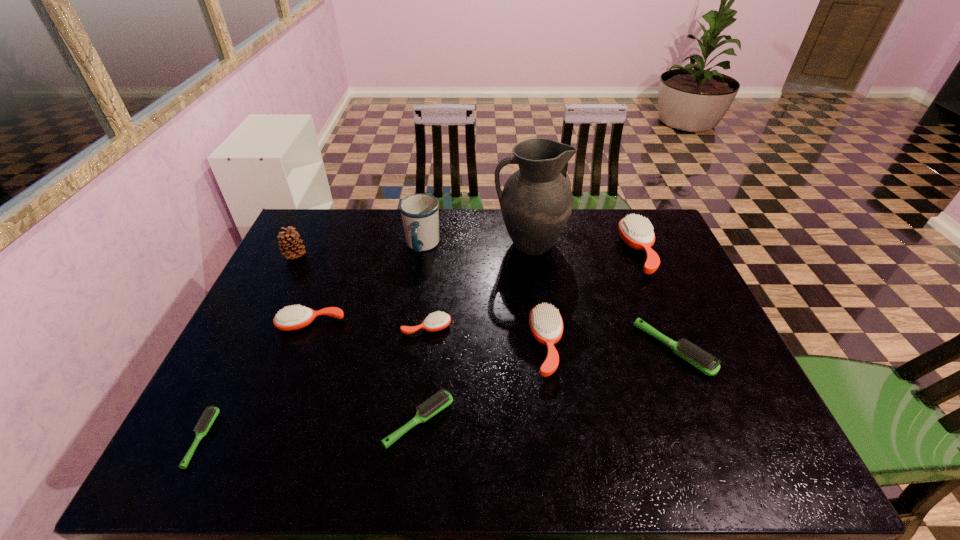
Locate an element on the screen. This screenshot has width=960, height=540. the biggest light hairbrush is located at coordinates (704, 362).

The height and width of the screenshot is (540, 960). Identify the location of the farthest light hairbrush. (704, 362).

The image size is (960, 540). Find the location of `the second orange hairbrush from left to right`. the second orange hairbrush from left to right is located at coordinates click(437, 321).

Locate an element on the screen. The image size is (960, 540). the ninth tallest object is located at coordinates (435, 404).

Identify the location of the second shortest hairbrush. This screenshot has height=540, width=960. (435, 404).

The width and height of the screenshot is (960, 540). I want to click on the leftmost light hairbrush, so [211, 413].

Identify the location of the leftmost hairbrush. (211, 413).

Locate an element on the screen. This screenshot has height=540, width=960. free region located 0.310m on the side of the pitcher with the handle is located at coordinates (398, 244).

Identify the location of blank space located on the side of the pitcher with the handle. click(x=398, y=244).

Find the location of a particular element. free space located on the side of the pitcher with the handle is located at coordinates (468, 244).